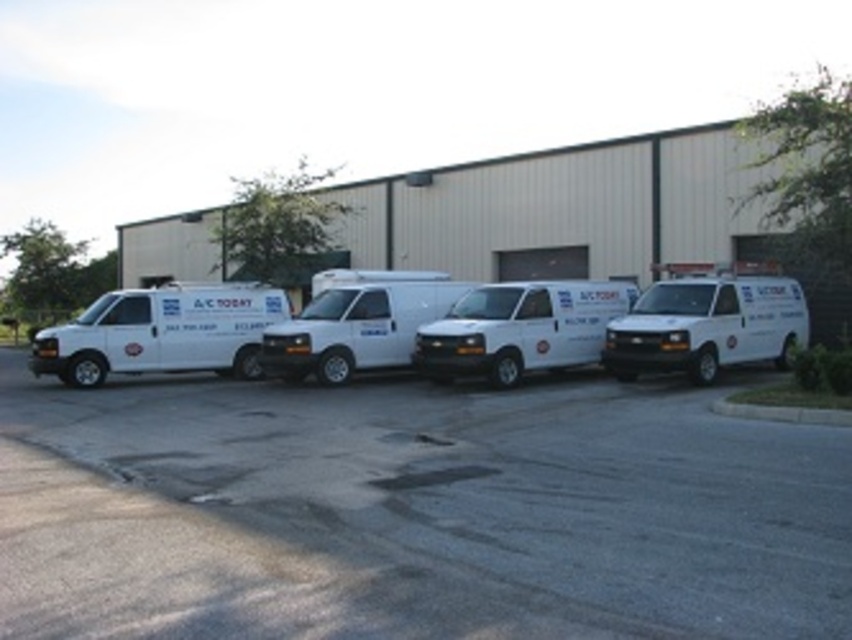
You are a delivery person who needs to load a tall package into one of the white matte vans. Which van should you choose between the white matte van at right and the white matte van at center?

The white matte van at center is taller than the white matte van at right, so you should choose the white matte van at center to load the tall package.

You are standing in front of the industrial building and notice two white matte vans. Which van, the white matte van at left or the white matte van at center, is positioned higher from the ground?

The white matte van at left is located above the white matte van at center, so it is positioned higher from the ground.

You are a delivery driver who needs to park your van on the white asphalt parking lot at center. However, there is already a white glossy van at center parked there. Can you park your van in the same spot without overlapping?

The white asphalt parking lot at center is positioned under the white glossy van at center, meaning the van is already occupying that spot. Therefore, you cannot park your van in the same spot without overlapping.